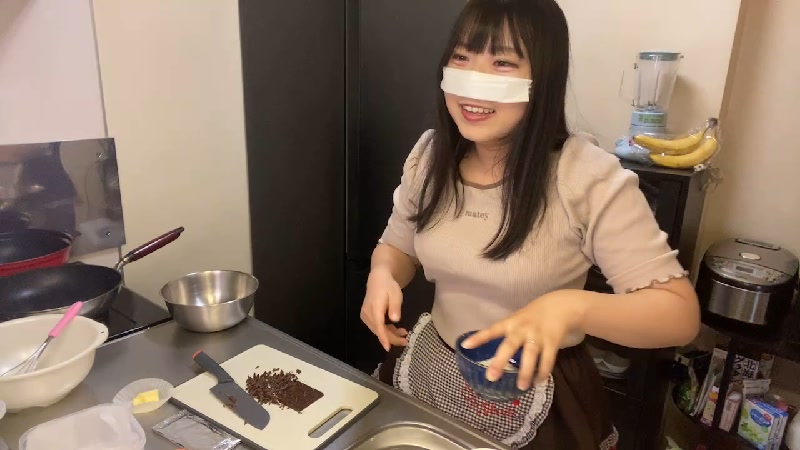
I want to click on red pan, so click(30, 250).